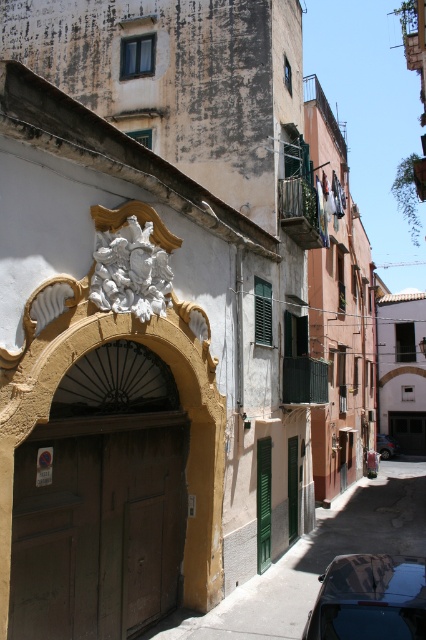
Identify the location of shiny black car at lower right. The image size is (426, 640). (370, 600).

Does shiny black car at lower right come in front of metallic silver car at center?

Yes, shiny black car at lower right is closer to the viewer.

Between point (420, 589) and point (385, 435), which one is positioned behind?

Point (385, 435)

The width and height of the screenshot is (426, 640). Find the location of `shiny black car at lower right`. shiny black car at lower right is located at coordinates point(370,600).